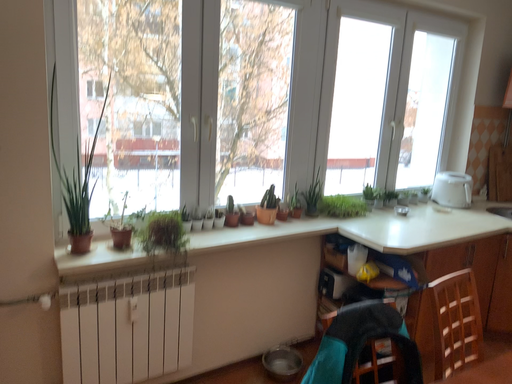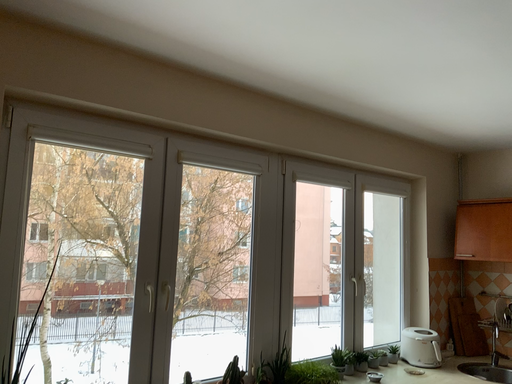
Question: How did the camera likely rotate when shooting the video?

Choices:
 (A) rotated upward
 (B) rotated downward

Answer: (A)